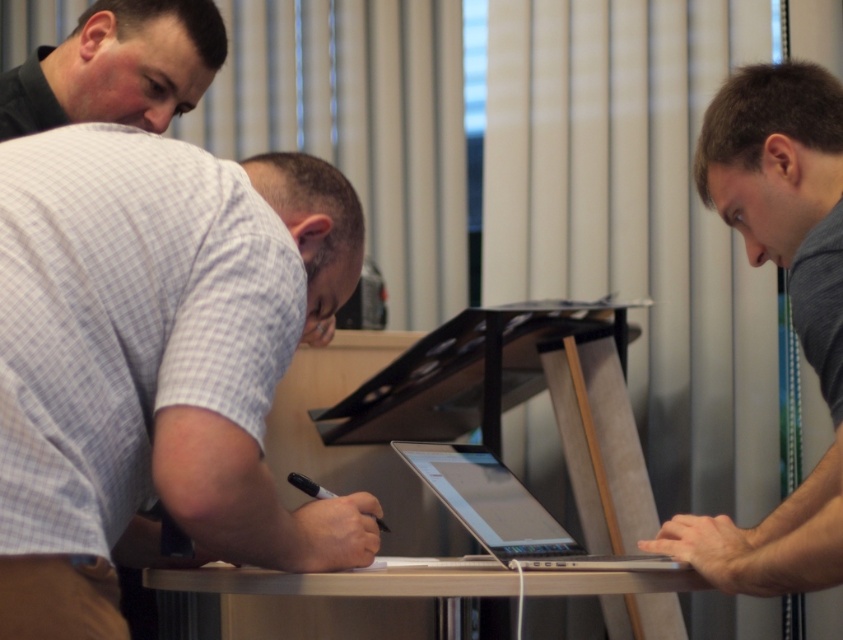
Where is `silver metallic table at center`? silver metallic table at center is located at coordinates pos(465,580).

Image resolution: width=843 pixels, height=640 pixels. Describe the element at coordinates (465, 580) in the screenshot. I see `silver metallic table at center` at that location.

Locate an element on the screen. Image resolution: width=843 pixels, height=640 pixels. silver metallic table at center is located at coordinates (465, 580).

Is white checkered shirt at upper left positioned in front of silver metallic table at center?

Yes, it is.

Does point (74, 314) lie in front of point (374, 564)?

Yes, it is.

The width and height of the screenshot is (843, 640). What are the coordinates of `white checkered shirt at upper left` in the screenshot? It's located at (160, 342).

Which is more to the right, matte black easel at center or silver metallic laptop at center?

From the viewer's perspective, silver metallic laptop at center appears more on the right side.

Measure the distance between matte black easel at center and camera.

matte black easel at center and camera are 8.57 feet apart from each other.

Between point (619, 541) and point (481, 516), which one is positioned in front?

Positioned in front is point (481, 516).

What are the coordinates of `matte black easel at center` in the screenshot? It's located at (471, 412).